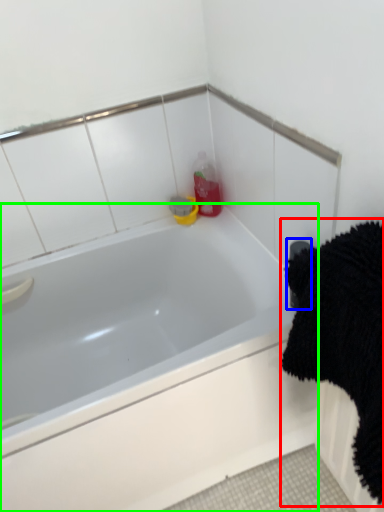
Question: Estimate the real-world distances between objects in this image. Which object is farther from bath towel (highlighted by a red box), towel bar (highlighted by a blue box) or bathtub (highlighted by a green box)?

Choices:
 (A) towel bar
 (B) bathtub

Answer: (B)